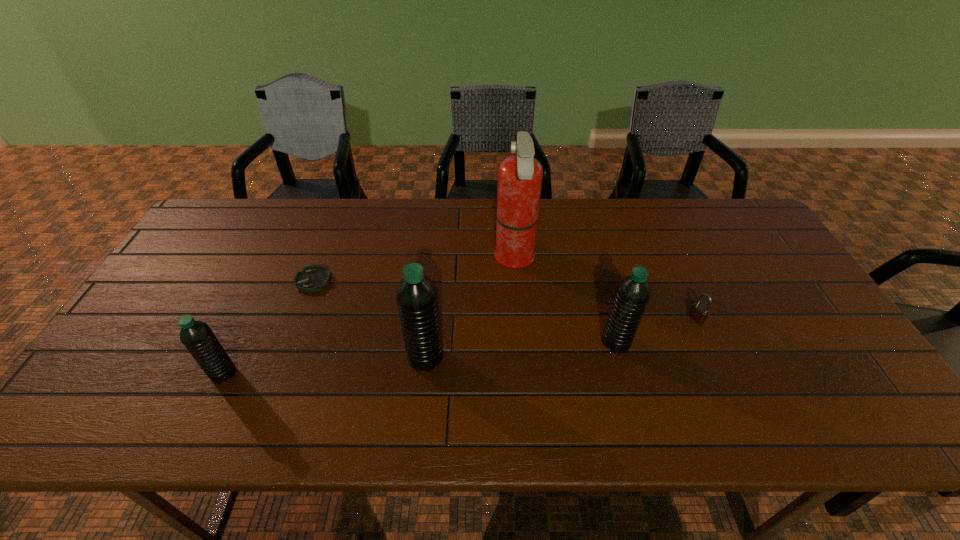
The height and width of the screenshot is (540, 960). Identify the location of free space that is in between the padlock and the fire extinguisher. (606, 288).

At what (x,y) coordinates should I click in order to perform the action: click on free spot between the fourth nearest object and the leftmost object. Please return your answer as a coordinate pair (x, y). The height and width of the screenshot is (540, 960). Looking at the image, I should click on (460, 346).

The height and width of the screenshot is (540, 960). I want to click on unoccupied area between the fifth object from right to left and the fifth object from left to right, so click(x=465, y=312).

Locate an element on the screen. This screenshot has height=540, width=960. vacant area that lies between the shortest water bottle and the fire extinguisher is located at coordinates (370, 316).

Identify the location of free space between the fire extinguisher and the leftmost object. The height and width of the screenshot is (540, 960). (370, 316).

Identify the location of free spot between the tallest water bottle and the second object from left to right. The image size is (960, 540). (370, 319).

You are a GUI agent. You are given a task and a screenshot of the screen. Output one action in this format:
    pyautogui.click(x=<x>, y=<y>)
    Task: Click on the object that is the fourth closest one to the shortest object
    Image resolution: width=960 pixels, height=540 pixels.
    Given the screenshot: What is the action you would take?
    pyautogui.click(x=633, y=292)

Locate an element on the screen. object that is the third closest to the leftmost water bottle is located at coordinates (520, 176).

The image size is (960, 540). I want to click on the second closest water bottle relative to the third object from right to left, so click(x=416, y=295).

Choose which water bottle is the nearest neighbor to the fourth shortest object. Please provide its 2D coordinates. Your answer should be formatted as a tuple, i.e. [(x, y)], where the tuple contains the x and y coordinates of a point satisfying the conditions above.

[(416, 295)]